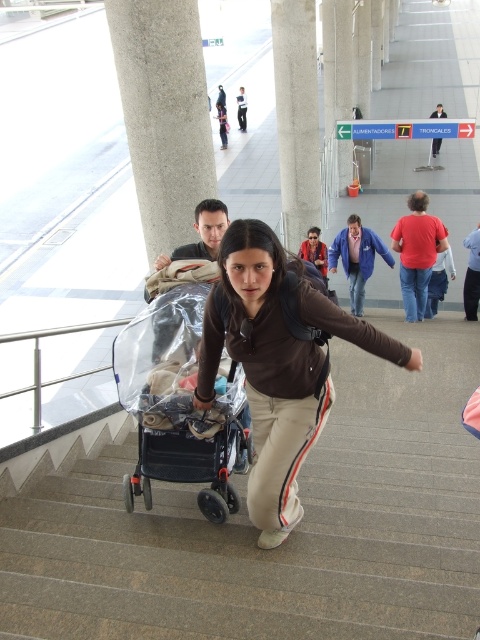
Question: Estimate the real-world distances between objects in this image. Which object is farther from the white fabric shirt at center?

Choices:
 (A) transparent plastic baby carriage at center
 (B) brown matte jacket at center
 (C) matte black stroller at center

Answer: (B)

Question: Which point is closer to the camera taking this photo?

Choices:
 (A) (432, 115)
 (B) (276, 248)
 (C) (142, 390)
 (D) (201, 572)

Answer: (B)

Question: Is smooth concrete stairs at center behind matte black stroller at center?

Choices:
 (A) yes
 (B) no

Answer: (B)

Question: Is transparent plastic baby carriage at center to the left of matte black stroller at center from the viewer's perspective?

Choices:
 (A) yes
 (B) no

Answer: (B)

Question: Is transparent plastic baby carriage at center to the left of white fabric shirt at center from the viewer's perspective?

Choices:
 (A) yes
 (B) no

Answer: (A)

Question: Estimate the real-world distances between objects in this image. Which object is closer to the matte black stroller at center?

Choices:
 (A) white fabric shirt at center
 (B) transparent plastic baby carriage at center
 (C) blue denim jacket at center

Answer: (A)